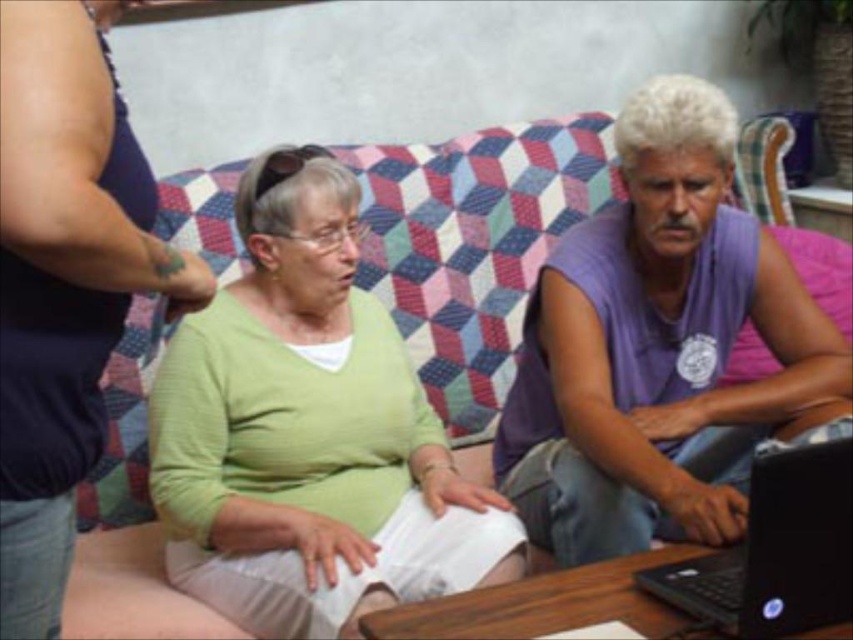
You are an interior designer observing the scene. You notice two items labeled as the green matte sweater at center and the matte green sweater at center. Which one is taller?

The green matte sweater at center is taller than the matte green sweater at center.

You are a delivery person who needs to place a small package on the table between the green matte sweater at center and the black plastic laptop at lower right. Can you fit it there?

The green matte sweater at center is taller than the black plastic laptop at lower right, so there might be enough space between them to place the small package, but the exact dimensions aren